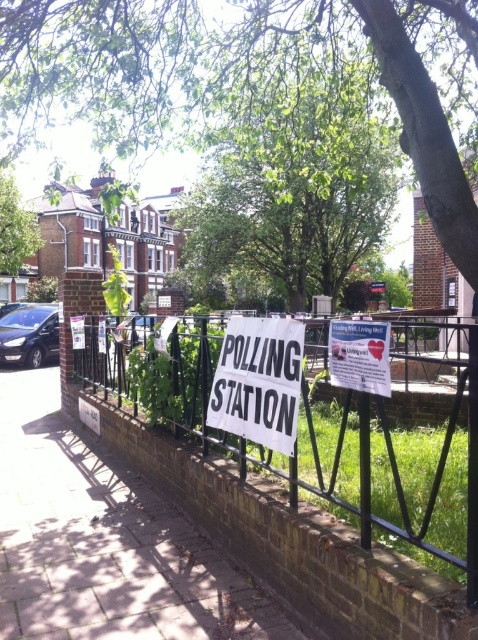
Is green leafy tree at upper center shorter than green leafy tree at center?

Incorrect, green leafy tree at upper center's height does not fall short of green leafy tree at center's.

The height and width of the screenshot is (640, 478). Identify the location of green leafy tree at upper center. (96, 65).

Locate an element on the screen. The height and width of the screenshot is (640, 478). green leafy tree at upper center is located at coordinates (96, 65).

Is black metal fence at center to the right of white paper poster at center from the viewer's perspective?

Correct, you'll find black metal fence at center to the right of white paper poster at center.

Find the location of a particular element. The height and width of the screenshot is (640, 478). black metal fence at center is located at coordinates point(284,413).

Which is behind, point (22, 538) or point (303, 336)?

Positioned behind is point (22, 538).

Is white concrete pavement at center taller than white paper sign at center?

No.

Describe the element at coordinates (104, 541) in the screenshot. I see `white concrete pavement at center` at that location.

The width and height of the screenshot is (478, 640). Find the location of `white concrete pavement at center`. white concrete pavement at center is located at coordinates (104, 541).